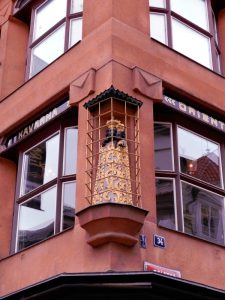
Find the location of `window seal`. window seal is located at coordinates (9, 168), (2, 228).